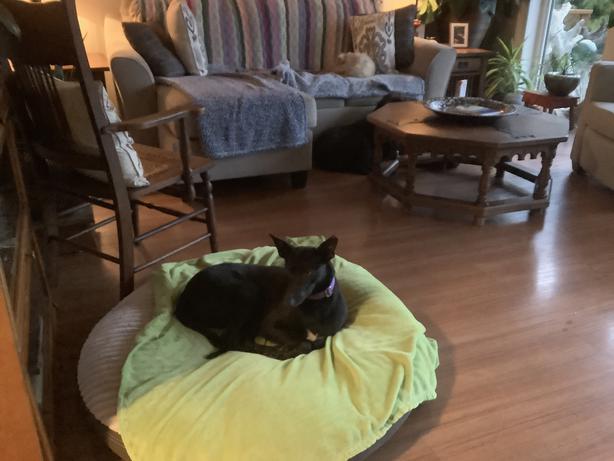
Find the location of `couch`. couch is located at coordinates (303, 56).